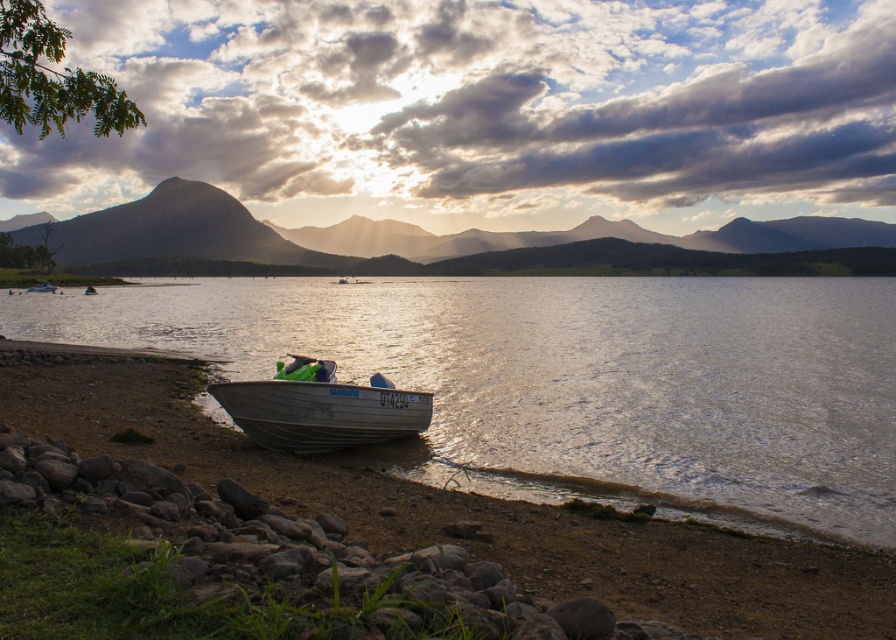
You are standing at the lakeside and want to take a photo of the matte gray mountain at center and the silver metallic boat at lower center. Which object should you focus on first if you want both to be in clear focus?

You should focus on the matte gray mountain at center first because it is closer to you than the silver metallic boat at lower center, so adjusting focus from near to far will help both be in clear focus.

You are standing at the lakeside and want to take a photo of the matte gray mountain at center. If your camera has a maximum zoom range of 100 meters, can you capture the entire mountain in one shot without moving?

The matte gray mountain at center is 122.59 meters away from the viewer. Since the camera can only zoom up to 100 meters, you cannot capture the entire mountain in one shot without moving closer or using a different camera with a longer zoom range.

You are an observer standing on the lakeside shore. You notice the clear water at boat left and the matte gray mountain at center. Which object appears narrower from your perspective?

The clear water at boat left appears narrower than the matte gray mountain at center from your perspective.